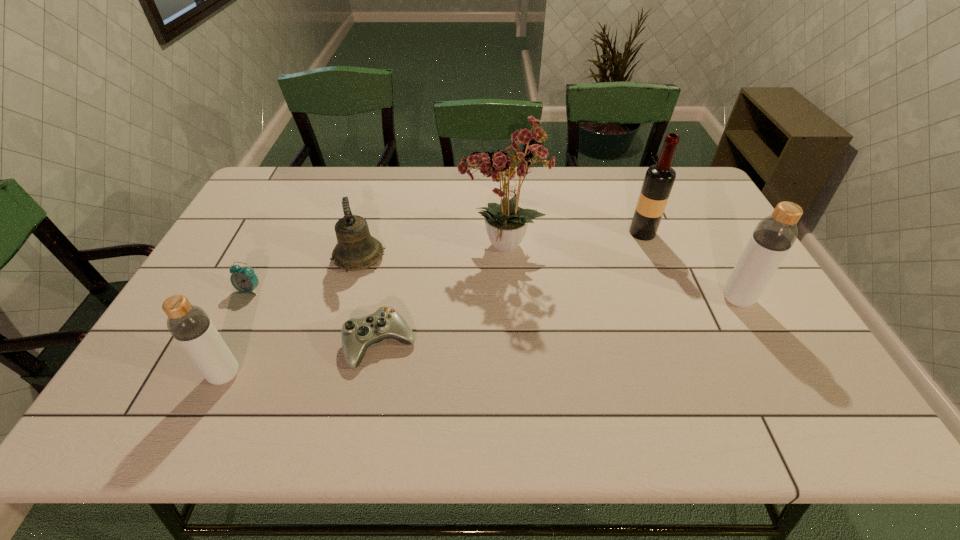
The height and width of the screenshot is (540, 960). Identify the location of free space located 0.320m on the back of the fourth shortest object. (276, 267).

The width and height of the screenshot is (960, 540). In order to click on vacant space located on the left of the taller bottle in this screenshot , I will do `click(650, 299)`.

Where is `free space located 0.290m on the back of the second object from right to left`? The width and height of the screenshot is (960, 540). free space located 0.290m on the back of the second object from right to left is located at coordinates (619, 175).

The image size is (960, 540). What are the coordinates of `vacant area situated 0.170m on the front-facing side of the fifth object from left to right` in the screenshot? It's located at (396, 247).

This screenshot has height=540, width=960. Find the location of `vacant space located on the front-facing side of the fifth object from left to right`. vacant space located on the front-facing side of the fifth object from left to right is located at coordinates (353, 247).

Find the location of a particular element. The height and width of the screenshot is (540, 960). blank space located 0.250m on the front-facing side of the fifth object from left to right is located at coordinates (371, 247).

You are a GUI agent. You are given a task and a screenshot of the screen. Output one action in this format:
    pyautogui.click(x=<x>, y=<y>)
    Task: Click on the vacant point located on the left of the third shortest object
    
    Given the screenshot: What is the action you would take?
    pyautogui.click(x=233, y=257)

The image size is (960, 540). I want to click on vacant region located on the face of the alarm clock, so click(238, 314).

What are the coordinates of `vacant region located 0.250m on the left of the shortest object` in the screenshot? It's located at (242, 344).

The height and width of the screenshot is (540, 960). Identify the location of bottle located in the near edge section of the desktop. (190, 326).